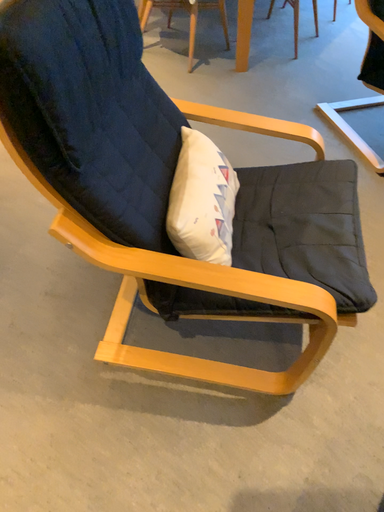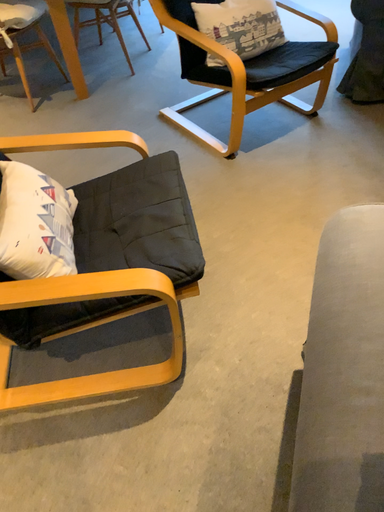
Question: How did the camera likely rotate when shooting the video?

Choices:
 (A) rotated left
 (B) rotated right

Answer: (B)